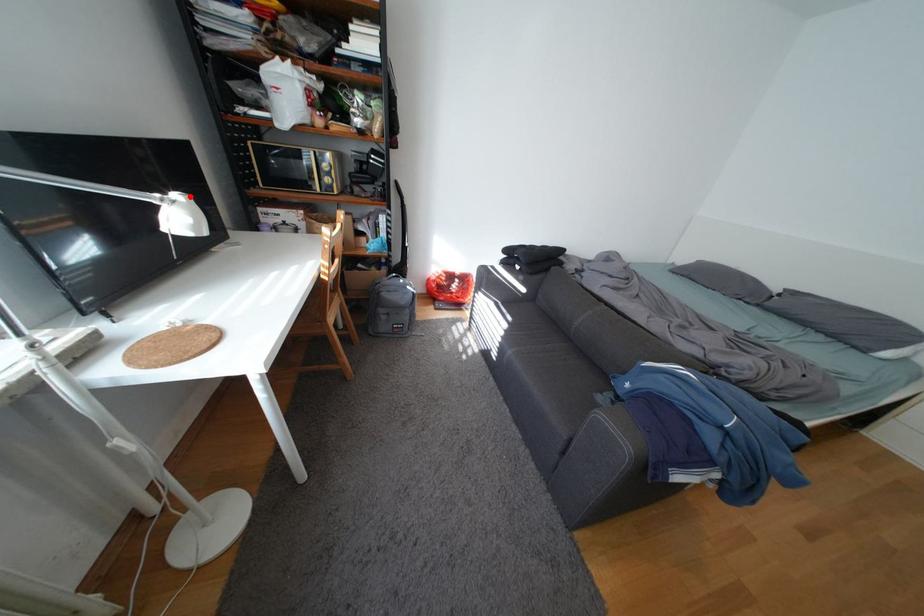
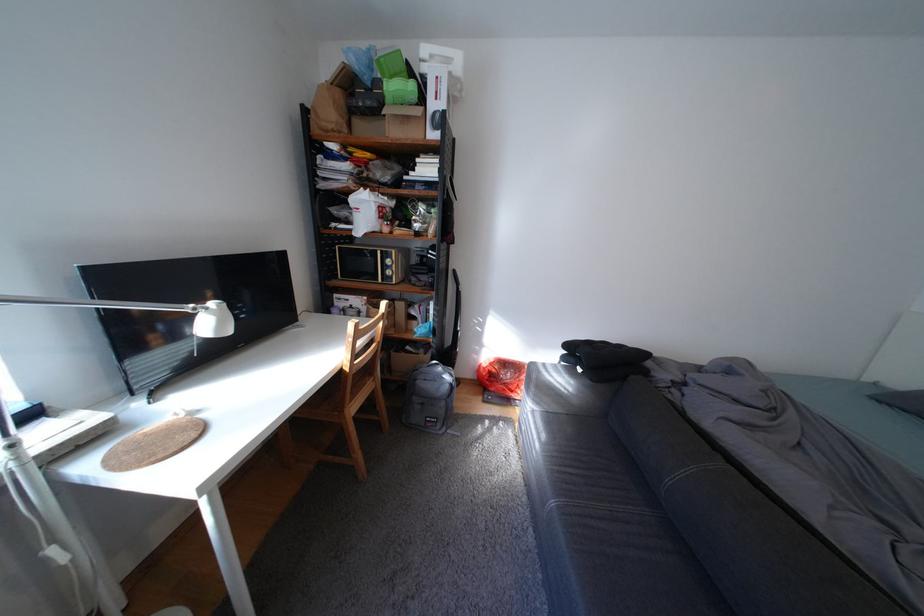
Locate, in the second image, the point that corresponds to the highlighted location in the first image.

(225, 305)